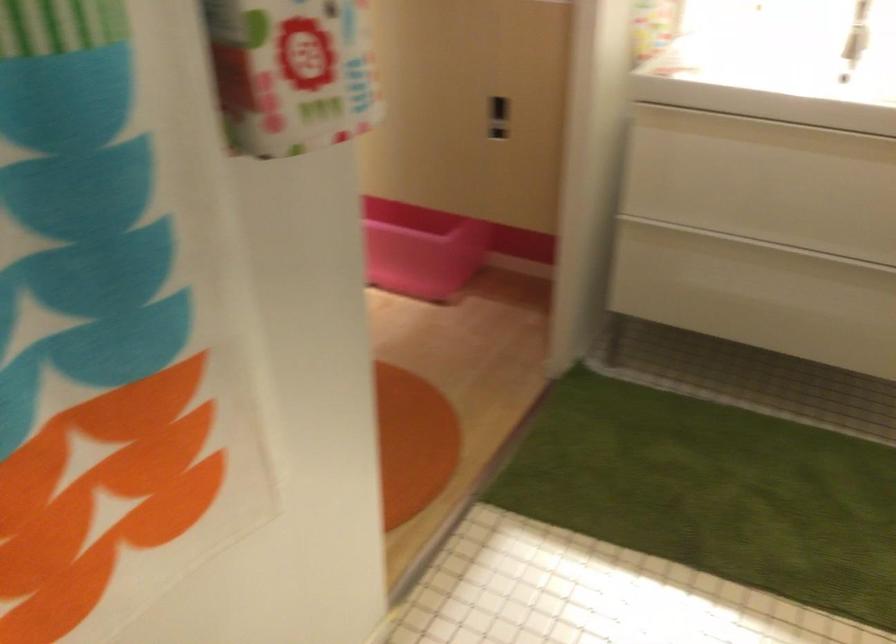
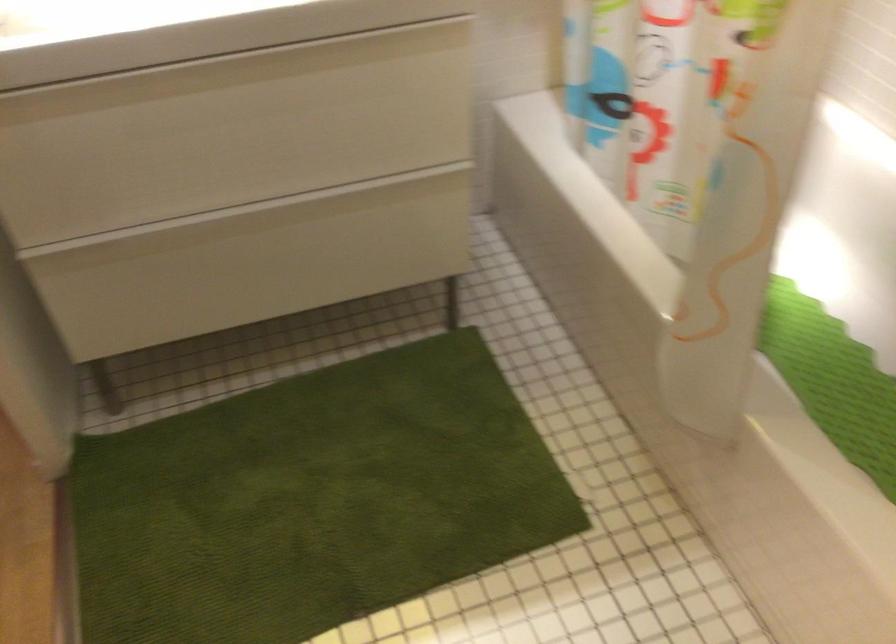
In the second image, find the point that corresponds to (x=811, y=279) in the first image.

(289, 238)